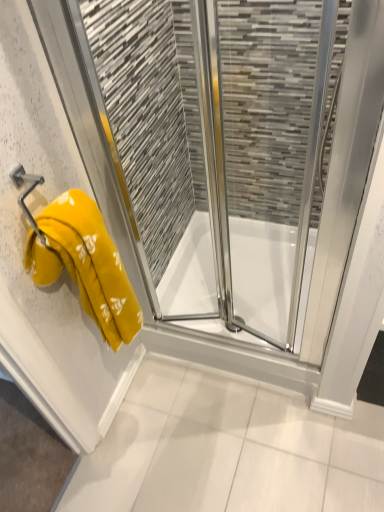
What do you see at coordinates (262, 273) in the screenshot? I see `transparent glass shower at center` at bounding box center [262, 273].

Measure the distance between transparent glass shower at center and camera.

transparent glass shower at center is 1.10 meters from camera.

What are the coordinates of `yellow fabric towel at left` in the screenshot? It's located at (86, 264).

Which is nearer, (30,174) or (106,332)?

Point (30,174).

This screenshot has width=384, height=512. Identify the location of towel bar behind the yellow fabric towel at left. (27, 195).

Does metallic yellow towel bar at left turn towards yellow fabric towel at left?

No, metallic yellow towel bar at left is not turned towards yellow fabric towel at left.

From a real-world perspective, is metallic yellow towel bar at left above or below yellow fabric towel at left?

From a real-world perspective, metallic yellow towel bar at left is physically above yellow fabric towel at left.

Between yellow towel at left and transparent glass shower at center, which one has smaller size?

With smaller size is transparent glass shower at center.

Is yellow towel at left aimed at transparent glass shower at center?

No, yellow towel at left does not turn towards transparent glass shower at center.

Considering the points (118, 111) and (280, 311), which point is behind, point (118, 111) or point (280, 311)?

The point (280, 311) is farther from the camera.

Is yellow fabric towel at left looking in the opposite direction of transparent glass shower at center?

No, yellow fabric towel at left is not facing the opposite direction of transparent glass shower at center.

Considering the relative positions of yellow fabric towel at left and transparent glass shower at center in the image provided, is yellow fabric towel at left to the left or to the right of transparent glass shower at center?

From the image, it's evident that yellow fabric towel at left is to the left of transparent glass shower at center.

Is yellow fabric towel at left far from transparent glass shower at center?

yellow fabric towel at left is actually quite close to transparent glass shower at center.

From the image's perspective, which one is positioned higher, yellow fabric towel at left or transparent glass shower at center?

yellow fabric towel at left.

Is metallic yellow towel bar at left not near transparent glass shower at center?

Yes.

Is metallic yellow towel bar at left positioned beyond the bounds of transparent glass shower at center?

Yes, metallic yellow towel bar at left is not within transparent glass shower at center.

Considering the sizes of metallic yellow towel bar at left and transparent glass shower at center in the image, is metallic yellow towel bar at left taller or shorter than transparent glass shower at center?

Considering their sizes, metallic yellow towel bar at left has less height than transparent glass shower at center.

Is metallic yellow towel bar at left in front of or behind transparent glass shower at center in the image?

metallic yellow towel bar at left is positioned closer to the viewer than transparent glass shower at center.

Which point is more distant from viewer, (x=236, y=218) or (x=197, y=112)?

The point (x=236, y=218) is behind.

Considering the relative positions of transparent glass shower at center and yellow towel at left in the image provided, is transparent glass shower at center to the left of yellow towel at left from the viewer's perspective?

No.

Is transparent glass shower at center taller than yellow towel at left?

No.

From a real-world perspective, is yellow towel at left under yellow fabric towel at left?

Incorrect, from a real-world perspective, yellow towel at left is higher than yellow fabric towel at left.

Which of these two, yellow towel at left or yellow fabric towel at left, is wider?

yellow fabric towel at left is wider.

Is yellow towel at left completely or partially outside of yellow fabric towel at left?

yellow towel at left is positioned outside yellow fabric towel at left.

Can you tell me how much yellow fabric towel at left and yellow towel at left differ in facing direction?

90 degrees.

Which of these two, yellow fabric towel at left or yellow towel at left, is wider?

Wider between the two is yellow fabric towel at left.

Is yellow fabric towel at left not near yellow towel at left?

No.

Based on their sizes in the image, would you say yellow fabric towel at left is bigger or smaller than yellow towel at left?

In the image, yellow fabric towel at left appears to be smaller than yellow towel at left.

Image resolution: width=384 pixels, height=512 pixels. I want to click on towel bar above the yellow fabric towel at left (from the image's perspective), so click(x=27, y=195).

Locate an element on the screen. The height and width of the screenshot is (512, 384). screen door in front of the transparent glass shower at center is located at coordinates (225, 150).

Estimate the real-world distances between objects in this image. Which object is further from yellow towel at left, metallic yellow towel bar at left or transparent glass shower at center?

Based on the image, metallic yellow towel bar at left appears to be further to yellow towel at left.

Based on their spatial positions, is yellow fabric towel at left or transparent glass shower at center closer to yellow towel at left?

transparent glass shower at center is positioned closer to the anchor yellow towel at left.

Based on their spatial positions, is transparent glass shower at center or yellow fabric towel at left further from metallic yellow towel bar at left?

transparent glass shower at center is positioned further to the anchor metallic yellow towel bar at left.

Considering their positions, is metallic yellow towel bar at left positioned closer to yellow fabric towel at left than yellow towel at left?

Among the two, metallic yellow towel bar at left is located nearer to yellow fabric towel at left.

Considering their positions, is yellow towel at left positioned closer to metallic yellow towel bar at left than transparent glass shower at center?

yellow towel at left lies closer to metallic yellow towel bar at left than the other object.

When comparing their distances from yellow towel at left, does transparent glass shower at center or metallic yellow towel bar at left seem further?

metallic yellow towel bar at left is positioned further to the anchor yellow towel at left.

Considering their positions, is yellow fabric towel at left positioned further to metallic yellow towel bar at left than yellow towel at left?

→ The object further to metallic yellow towel bar at left is yellow towel at left.

When comparing their distances from yellow towel at left, does yellow fabric towel at left or metallic yellow towel bar at left seem closer?

yellow fabric towel at left lies closer to yellow towel at left than the other object.

The image size is (384, 512). I want to click on towel bar between yellow towel at left and transparent glass shower at center in the front-back direction, so click(27, 195).

Find the location of a particular element. This screenshot has width=384, height=512. towel bar between yellow fabric towel at left and transparent glass shower at center along the z-axis is located at coordinates (27, 195).

The height and width of the screenshot is (512, 384). In order to click on towel located between yellow towel at left and transparent glass shower at center in the depth direction in this screenshot , I will do pyautogui.click(x=86, y=264).

Where is `towel between metallic yellow towel bar at left and yellow towel at left in the horizontal direction`? This screenshot has height=512, width=384. towel between metallic yellow towel bar at left and yellow towel at left in the horizontal direction is located at coordinates (86, 264).